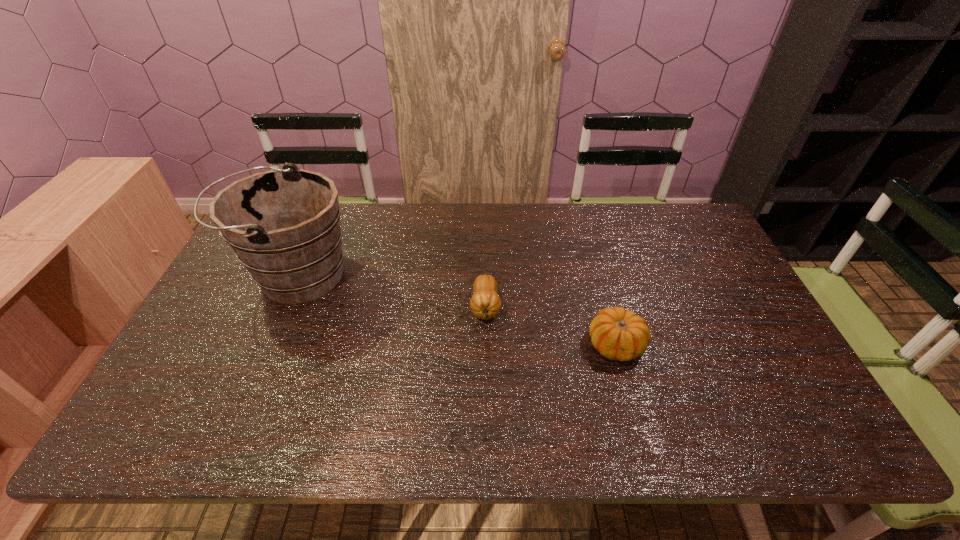
At what (x,y) coordinates should I click in order to perform the action: click on free region at the near edge of the desktop. Please return your answer as a coordinate pair (x, y). Looking at the image, I should click on (457, 410).

In the image, there is a desktop. Where is `vacant space at the left edge`? vacant space at the left edge is located at coordinates pyautogui.click(x=235, y=334).

This screenshot has height=540, width=960. In the image, there is a desktop. In order to click on vacant area at the right edge in this screenshot , I will do `click(740, 366)`.

Where is `vacant space at the far right corner of the desktop`? This screenshot has height=540, width=960. vacant space at the far right corner of the desktop is located at coordinates (658, 217).

The image size is (960, 540). Find the location of `vacant point at the near right corner`. vacant point at the near right corner is located at coordinates (812, 434).

This screenshot has width=960, height=540. Identify the location of free space between the right gourd and the second object from right to left. (551, 326).

Locate an element on the screen. The height and width of the screenshot is (540, 960). empty location between the tallest object and the rightmost object is located at coordinates (457, 309).

Find the location of `unoccupied position between the bucket and the second object from right to left`. unoccupied position between the bucket and the second object from right to left is located at coordinates (392, 291).

You are a GUI agent. You are given a task and a screenshot of the screen. Output one action in this format:
    pyautogui.click(x=<x>, y=<y>)
    Task: Click on the free area in between the bucket and the right gourd
    This screenshot has width=960, height=540.
    Given the screenshot: What is the action you would take?
    pyautogui.click(x=457, y=309)

At what (x,y) coordinates should I click in order to perform the action: click on free point between the left gourd and the tallest object. Please return your answer as a coordinate pair (x, y). The height and width of the screenshot is (540, 960). Looking at the image, I should click on (392, 291).